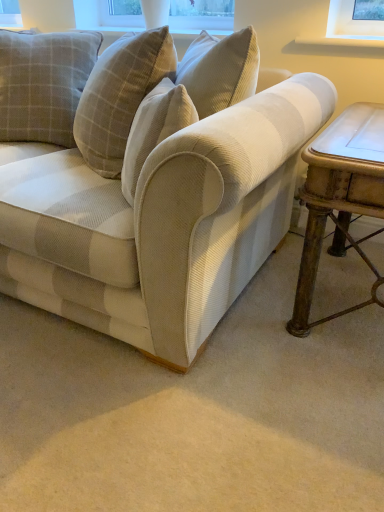
Question: From a real-world perspective, is beige corduroy couch at center physically above plaid fabric pillow at upper left?

Choices:
 (A) yes
 (B) no

Answer: (B)

Question: Is beige corduroy couch at center not near plaid fabric pillow at upper left?

Choices:
 (A) yes
 (B) no

Answer: (B)

Question: Can you confirm if beige corduroy couch at center is thinner than plaid fabric pillow at upper left?

Choices:
 (A) yes
 (B) no

Answer: (B)

Question: Does beige corduroy couch at center have a larger size compared to plaid fabric pillow at upper left?

Choices:
 (A) yes
 (B) no

Answer: (A)

Question: From the image's perspective, is beige corduroy couch at center over plaid fabric pillow at upper left?

Choices:
 (A) no
 (B) yes

Answer: (A)

Question: Is beige corduroy couch at center at the left side of plaid fabric pillow at upper left?

Choices:
 (A) no
 (B) yes

Answer: (A)

Question: Can you confirm if rustic wood table at right is taller than beige corduroy couch at center?

Choices:
 (A) yes
 (B) no

Answer: (B)

Question: From a real-world perspective, is rustic wood table at right physically below beige corduroy couch at center?

Choices:
 (A) yes
 (B) no

Answer: (A)

Question: Is rustic wood table at right facing towards beige corduroy couch at center?

Choices:
 (A) yes
 (B) no

Answer: (B)

Question: From a real-world perspective, is rustic wood table at right over beige corduroy couch at center?

Choices:
 (A) yes
 (B) no

Answer: (B)

Question: From the image's perspective, is rustic wood table at right below beige corduroy couch at center?

Choices:
 (A) yes
 (B) no

Answer: (A)

Question: Is beige corduroy couch at center inside rustic wood table at right?

Choices:
 (A) no
 (B) yes

Answer: (A)

Question: From the image's perspective, is beige corduroy couch at center beneath rustic wood table at right?

Choices:
 (A) yes
 (B) no

Answer: (B)